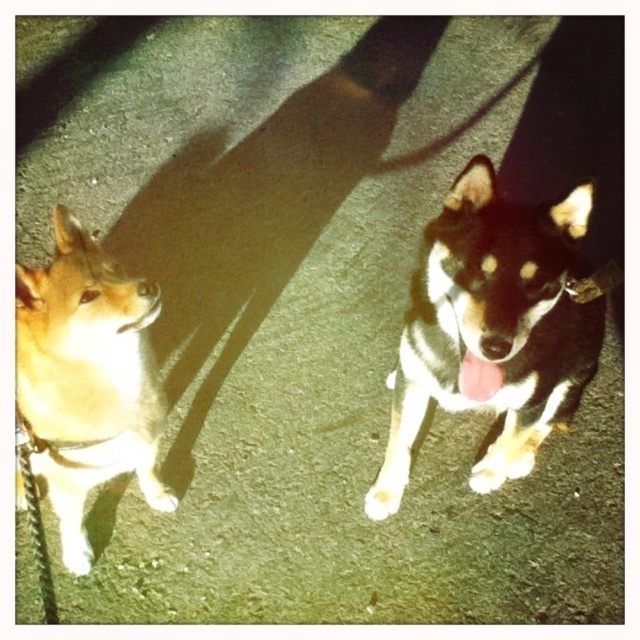
You are a dog owner trying to walk your light brown fur at left on a leash. There is a black and white fur dog at center nearby. Based on their positions, can you safely walk your dog without crossing paths with the other dog?

The black and white fur dog at center is positioned over light brown fur at left, which means they are directly in front of or above your dog. To avoid crossing paths, you should adjust your path to either go around or stay behind the black and white fur dog at center while walking your light brown fur at left.

You are a photographer trying to capture a photo of both dogs in the scene. Since you want them both in the frame, which direction should you position yourself relative to the light brown fur at left to ensure the black and white fur dog at center is also in view?

Position yourself to the right of the light brown fur at left so that the black and white fur dog at center, which is to the right of it, stays within your camera frame.